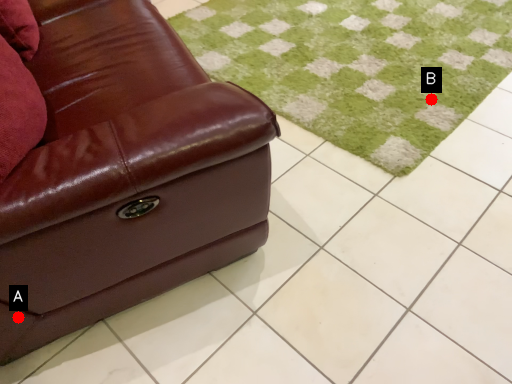
Question: Two points are circled on the image, labeled by A and B beside each circle. Which point is farther from the camera taking this photo?

Choices:
 (A) A is further
 (B) B is further

Answer: (B)